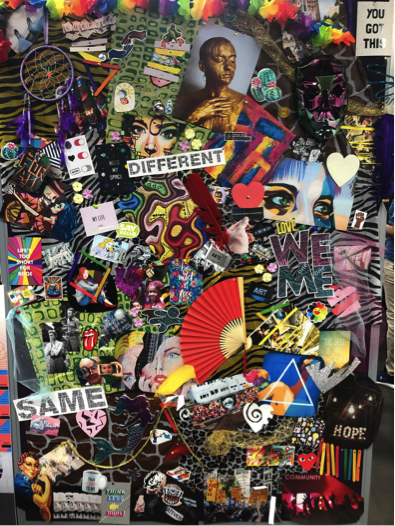
The image size is (395, 526). I want to click on fan, so click(229, 323).